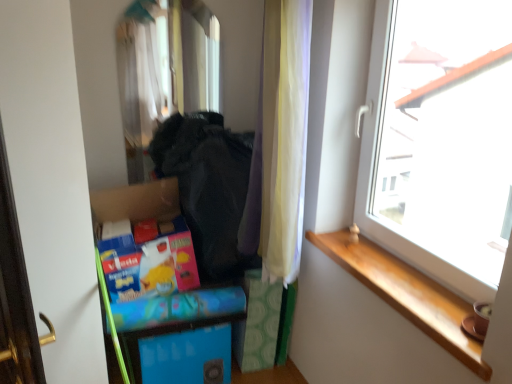
Question: Does wooden at right have a greater height compared to black fabric at center?

Choices:
 (A) no
 (B) yes

Answer: (A)

Question: From a real-world perspective, is wooden at right located higher than black fabric at center?

Choices:
 (A) no
 (B) yes

Answer: (A)

Question: Could black fabric at center be considered to be inside wooden at right?

Choices:
 (A) yes
 (B) no

Answer: (B)

Question: Does wooden at right lie behind black fabric at center?

Choices:
 (A) no
 (B) yes

Answer: (A)

Question: Considering the relative sizes of wooden at right and black fabric at center in the image provided, is wooden at right shorter than black fabric at center?

Choices:
 (A) yes
 (B) no

Answer: (A)

Question: From a real-world perspective, is blue cardboard box at lower center above or below black fabric at center?

Choices:
 (A) below
 (B) above

Answer: (A)

Question: Visually, is blue cardboard box at lower center positioned to the left or to the right of black fabric at center?

Choices:
 (A) left
 (B) right

Answer: (A)

Question: In terms of height, does blue cardboard box at lower center look taller or shorter compared to black fabric at center?

Choices:
 (A) tall
 (B) short

Answer: (B)

Question: Is blue cardboard box at lower center situated inside black fabric at center or outside?

Choices:
 (A) outside
 (B) inside

Answer: (A)

Question: From the image's perspective, relative to transparent glass window at upper right, is black fabric at center above or below?

Choices:
 (A) above
 (B) below

Answer: (B)

Question: Visually, is black fabric at center positioned to the left or to the right of transparent glass window at upper right?

Choices:
 (A) right
 (B) left

Answer: (B)

Question: In terms of size, does black fabric at center appear bigger or smaller than transparent glass window at upper right?

Choices:
 (A) big
 (B) small

Answer: (A)

Question: Choose the correct answer: Is black fabric at center inside transparent glass window at upper right or outside it?

Choices:
 (A) outside
 (B) inside

Answer: (A)

Question: Is point (203, 228) positioned closer to the camera than point (196, 352)?

Choices:
 (A) closer
 (B) farther

Answer: (A)

Question: From a real-world perspective, is black fabric at center positioned above or below blue cardboard box at lower center?

Choices:
 (A) above
 (B) below

Answer: (A)